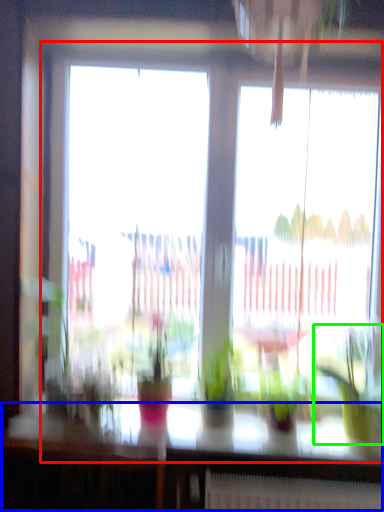
Question: Based on their relative distances, which object is nearer to window (highlighted by a red box)? Choose from table (highlighted by a blue box) and houseplant (highlighted by a green box).

Choices:
 (A) table
 (B) houseplant

Answer: (B)